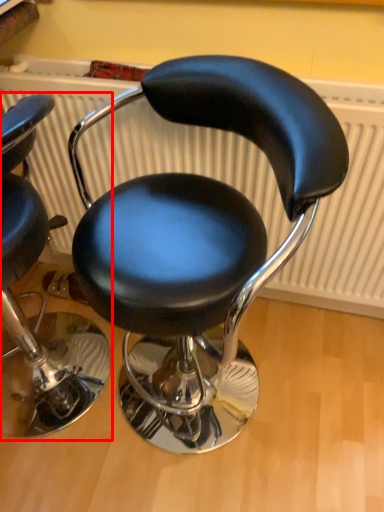
Question: From the image, what is the correct spatial relationship of chair (annotated by the red box) in relation to chair?

Choices:
 (A) left
 (B) right

Answer: (A)